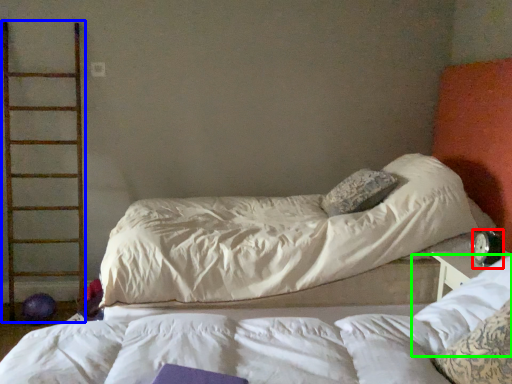
Question: Considering the real-world distances, which object is closest to alarm clock (highlighted by a red box)? ladder (highlighted by a blue box) or pillow (highlighted by a green box).

Choices:
 (A) ladder
 (B) pillow

Answer: (B)